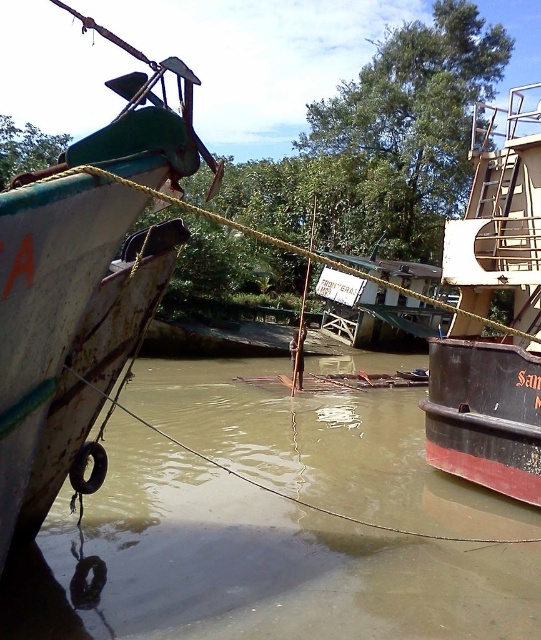
You are a photographer trying to capture both the rusty metal boat at left and the rusty metal boat at right in your shot. Based on their positions, which boat should you focus on first if you want to include both in your frame without moving the camera?

The rusty metal boat at left is located above the rusty metal boat at right, so you should focus on the rusty metal boat at left first to ensure both are in the frame.